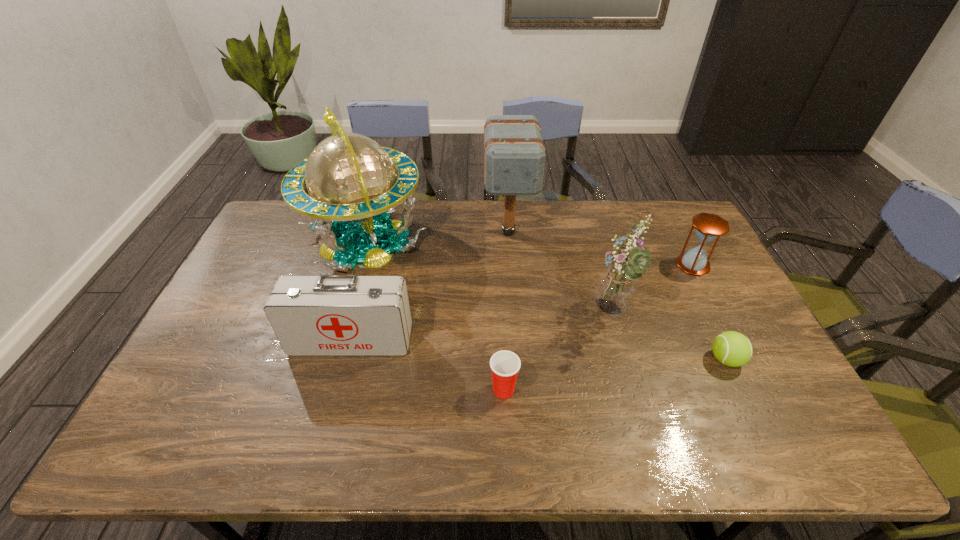
Locate an element on the screen. Image resolution: width=960 pixels, height=540 pixels. free space that satisfies the following two spatial constraints: 1. on the striking surface of the mallet; 2. on the left side of the shortest object is located at coordinates (517, 360).

Where is `free space that satisfies the following two spatial constraints: 1. on the front-facing side of the fourth shortest object; 2. on the left side of the sixth tallest object`? free space that satisfies the following two spatial constraints: 1. on the front-facing side of the fourth shortest object; 2. on the left side of the sixth tallest object is located at coordinates (338, 389).

Find the location of `free space in the image that satisfies the following two spatial constraints: 1. on the front-facing side of the third object from right to left; 2. on the back side of the tennis ball`. free space in the image that satisfies the following two spatial constraints: 1. on the front-facing side of the third object from right to left; 2. on the back side of the tennis ball is located at coordinates (624, 360).

Image resolution: width=960 pixels, height=540 pixels. I want to click on vacant point that satisfies the following two spatial constraints: 1. on the front-facing side of the first-aid kit; 2. on the left side of the shortest object, so click(347, 360).